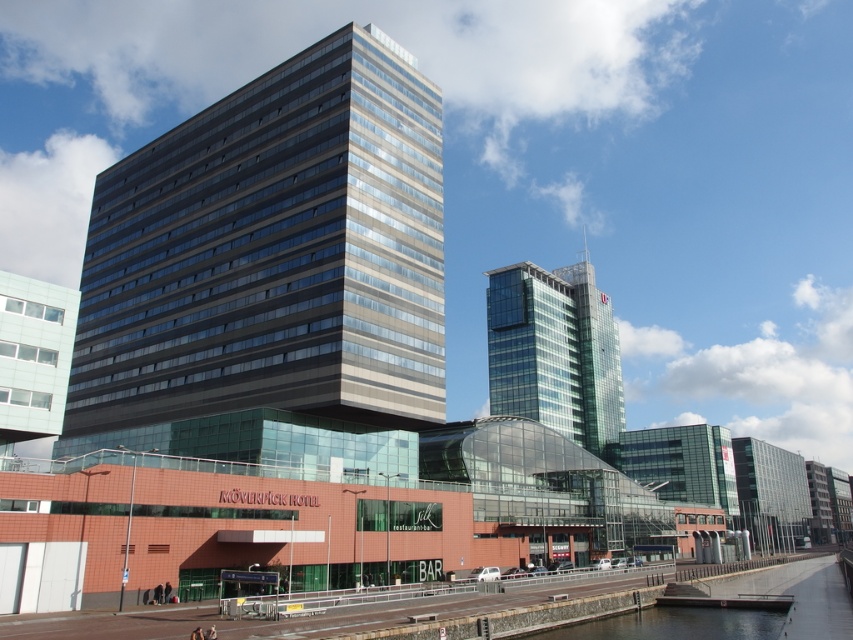
You are a city planner analyzing the skyline of this urban area. You need to determine which of the two buildings, the glassy metallic building at center or the clear glass skyscraper at center, has a greater height. Based on the provided scene description, which building is taller?

The glassy metallic building at center is much taller than the clear glass skyscraper at center, making it the taller building between the two.

You are an architect analyzing the urban skyline. You notice the glassy metallic building at center and the clear glass skyscraper at center. Which one is positioned higher in the image?

The glassy metallic building at center is positioned higher in the image than the clear glass skyscraper at center.

Consider the image. You are a photographer planning to capture a shot of the glassy metallic building at center and the smooth concrete river at lower center. Based on their positions, which object will appear closer to the camera in your photo?

The glassy metallic building at center will appear closer to the camera because the smooth concrete river at lower center is positioned behind it.